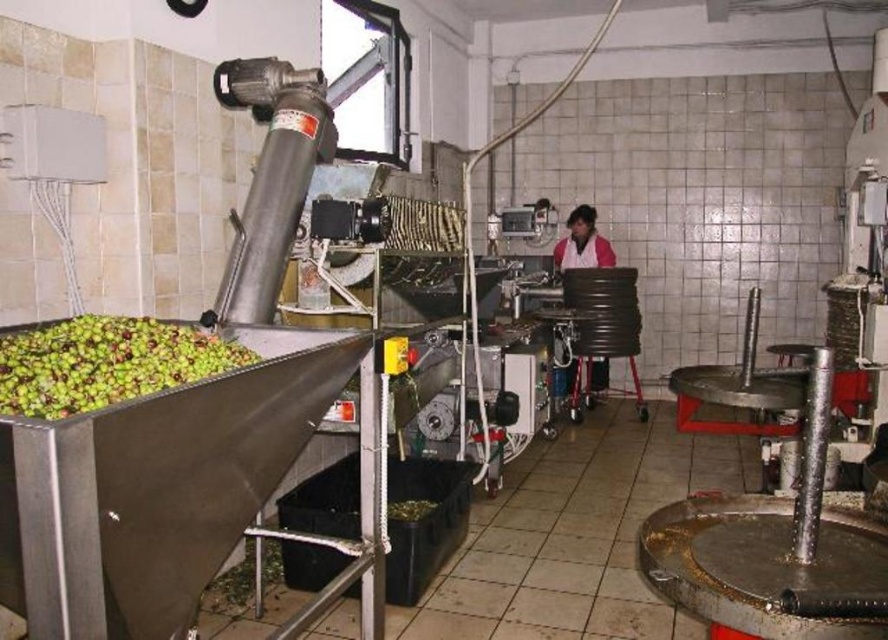
Between green matte olives at left and pink fabric at center, which one is positioned lower?

green matte olives at left is below.

Can you confirm if green matte olives at left is thinner than pink fabric at center?

No.

Who is more distant from viewer, [107,385] or [557,259]?

Positioned behind is point [557,259].

Where is `green matte olives at left`? Image resolution: width=888 pixels, height=640 pixels. green matte olives at left is located at coordinates (105, 362).